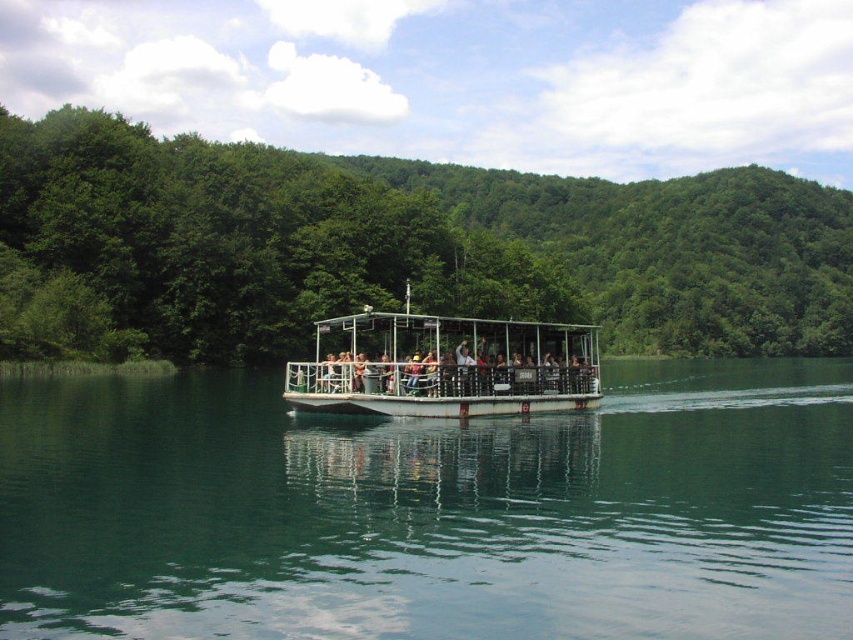
You are a photographer planning to capture the reflection of the green leafy trees at center and the white metal boat at center in the water. Which object will have a larger reflection in the water?

The green leafy trees at center has a larger size compared to the white metal boat at center, so their reflection in the water will also be larger.

You are standing on the deck of the boat and want to take a photo of the green leafy trees at center. The camera you have can focus on objects up to 60 meters away. Will the trees be in focus?

The green leafy trees at center is 58.60 meters from camera, so yes, the camera can focus on them since they are within the 60 meters range.